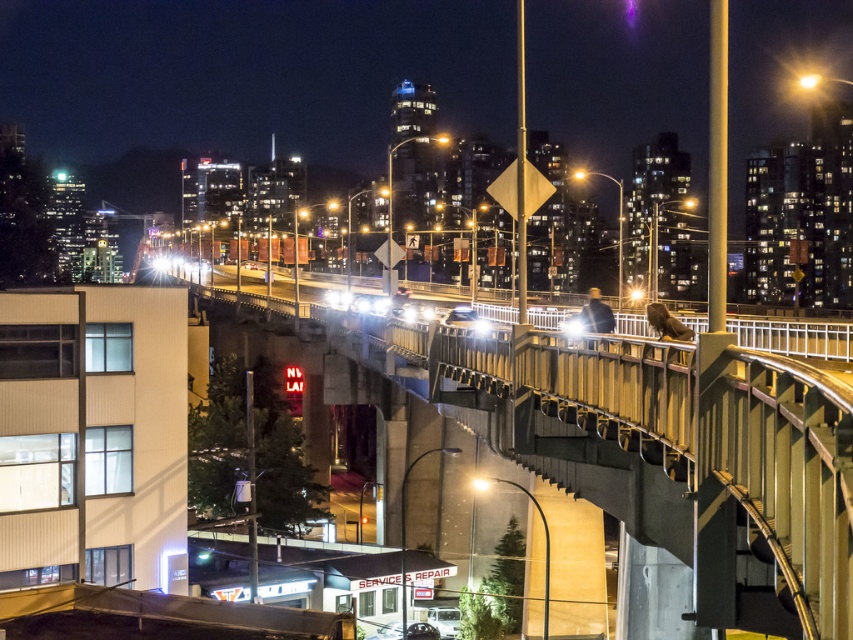
You are a city planner reviewing the urban layout. You need to determine which bridge is lower in elevation between the concrete bridge at center and the metallic gray bridge at center. Which one is it?

The concrete bridge at center has a lesser height compared to the metallic gray bridge at center, so the concrete bridge at center is lower in elevation.

Looking at this image, you are a city planner analyzing the layout of this urban area. The concrete bridge at center is positioned at coordinates 0.709, 0.791. If you need to place a new emergency exit sign on the bridge, which direction relative to the bridge should it be placed to ensure visibility from the highway below?

The concrete bridge at center is located at point (674,452). To ensure visibility from the highway below, the emergency exit sign should be placed on the side of the bridge facing the highway, which would be the lower portion relative to the bridge structure.